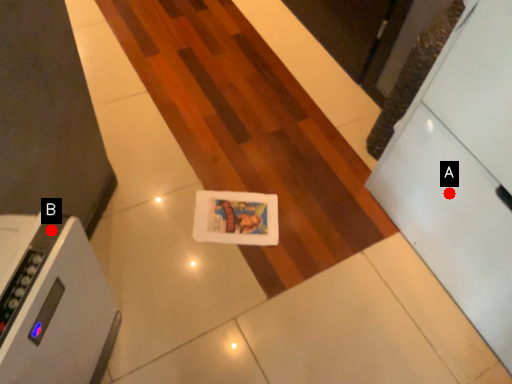
Question: Two points are circled on the image, labeled by A and B beside each circle. Which point is closer to the camera taking this photo?

Choices:
 (A) A is closer
 (B) B is closer

Answer: (B)